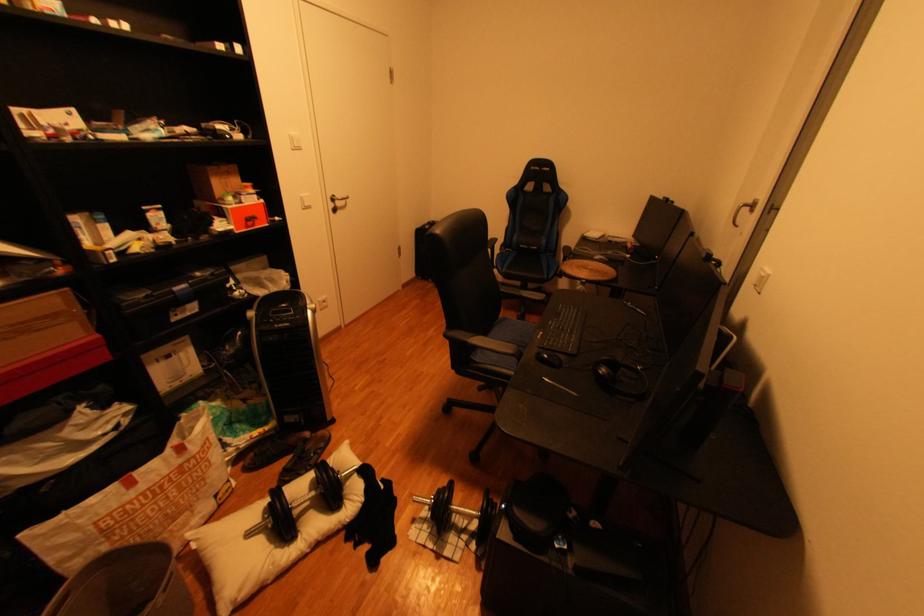
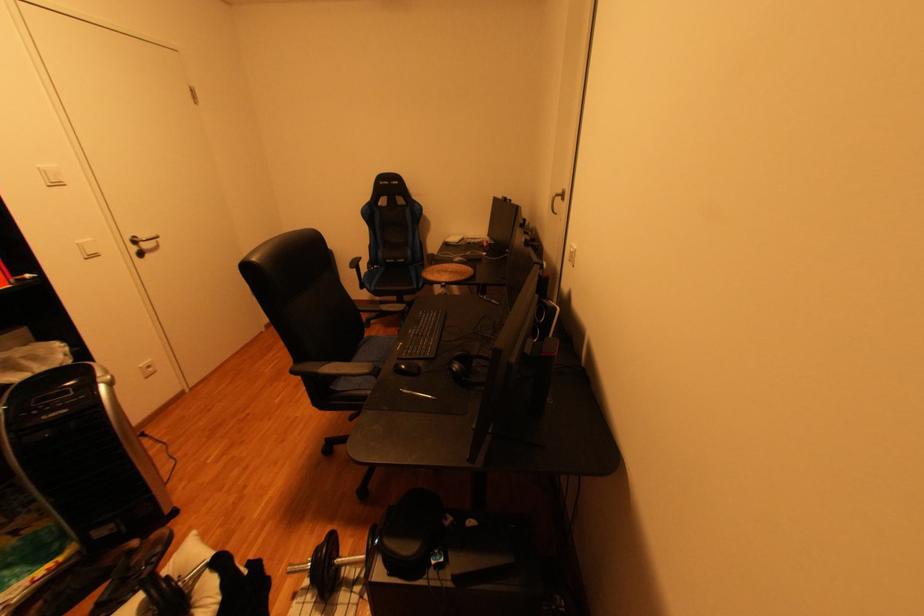
Question: The camera is either moving clockwise (left) or counter-clockwise (right) around the object. The first image is from the beginning of the video and the second image is from the end. Is the camera moving left or right when shooting the video?

Choices:
 (A) Left
 (B) Right

Answer: (A)